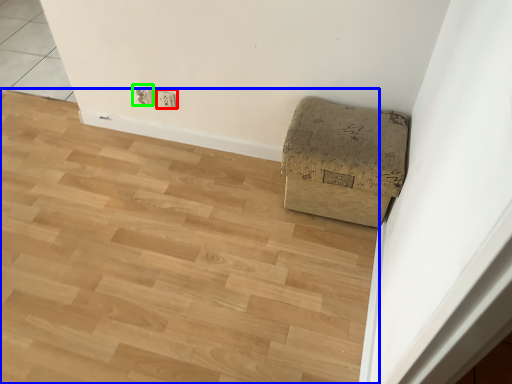
Question: Which object is positioned farthest from electric outlet (highlighted by a red box)? Select from plywood (highlighted by a blue box) and electric outlet (highlighted by a green box).

Choices:
 (A) plywood
 (B) electric outlet

Answer: (A)